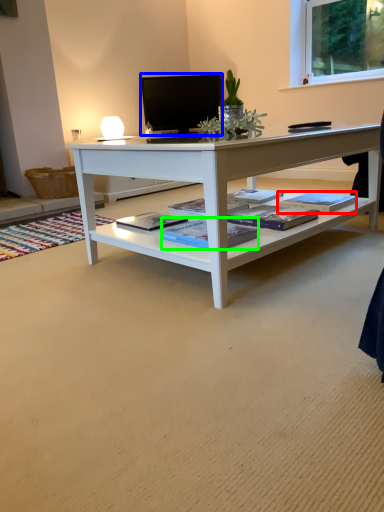
Question: Estimate the real-world distances between objects in this image. Which object is closer to book (highlighted by a red box), television (highlighted by a blue box) or book (highlighted by a green box)?

Choices:
 (A) television
 (B) book

Answer: (B)